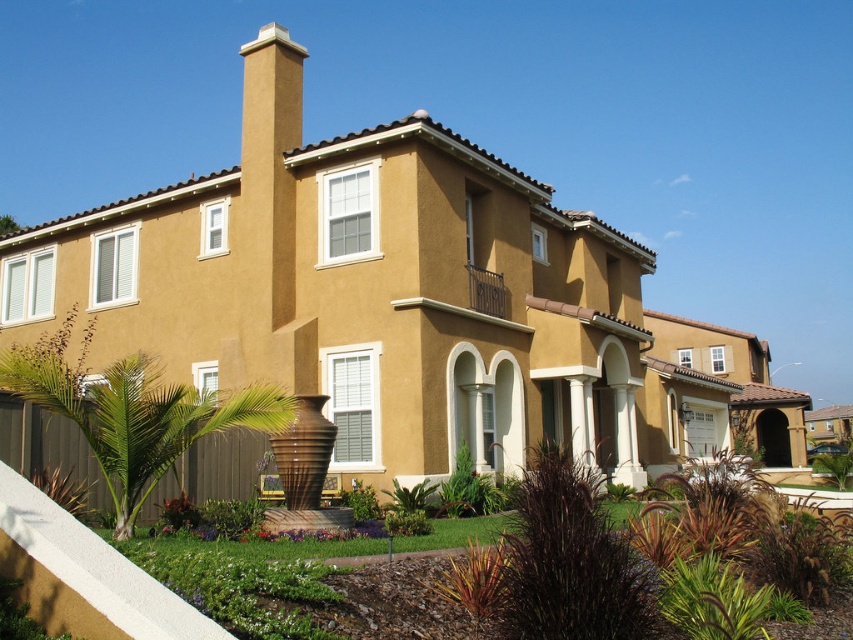
Is point (97, 396) closer to viewer compared to point (459, 492)?

Yes, point (97, 396) is closer to viewer.

Describe the element at coordinates (132, 412) in the screenshot. The height and width of the screenshot is (640, 853). I see `green leafy palm tree at lower left` at that location.

Is point (138, 401) in front of point (473, 461)?

That is True.

Locate an element on the screen. green leafy palm tree at lower left is located at coordinates (132, 412).

Which of these two, green leafy plant at center or green leafy bush at center, stands shorter?

Standing shorter between the two is green leafy bush at center.

Does green leafy plant at center appear under green leafy bush at center?

Yes, green leafy plant at center is below green leafy bush at center.

Image resolution: width=853 pixels, height=640 pixels. I want to click on green leafy plant at center, so click(x=469, y=490).

Image resolution: width=853 pixels, height=640 pixels. I want to click on green leafy plant at center, so click(x=469, y=490).

Does point (12, 380) come in front of point (354, 492)?

Yes, it is.

You are a GUI agent. You are given a task and a screenshot of the screen. Output one action in this format:
    pyautogui.click(x=<x>, y=<y>)
    Task: Click on the green leafy palm tree at lower left
    The width and height of the screenshot is (853, 640).
    Given the screenshot: What is the action you would take?
    pyautogui.click(x=132, y=412)

The height and width of the screenshot is (640, 853). Find the location of `green leafy palm tree at lower left`. green leafy palm tree at lower left is located at coordinates (132, 412).